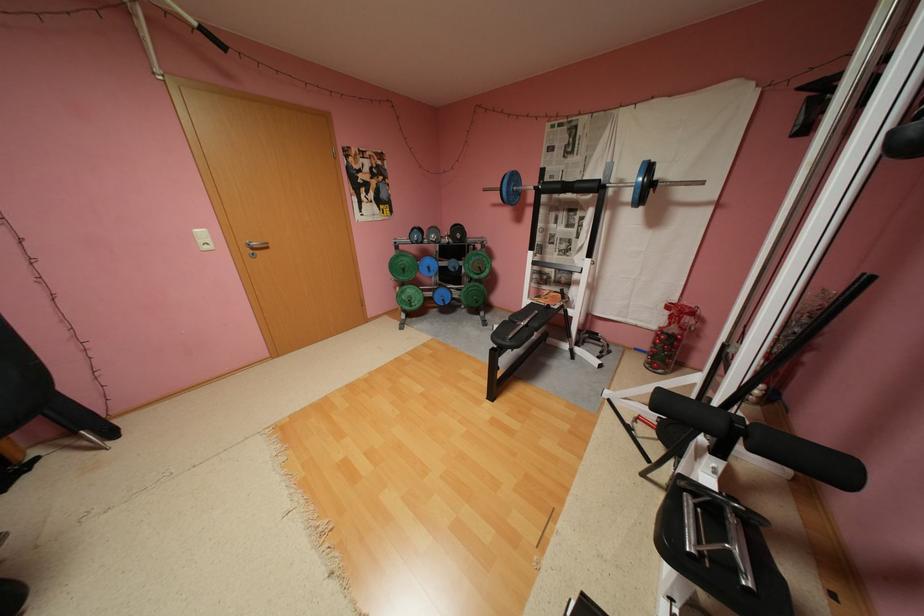
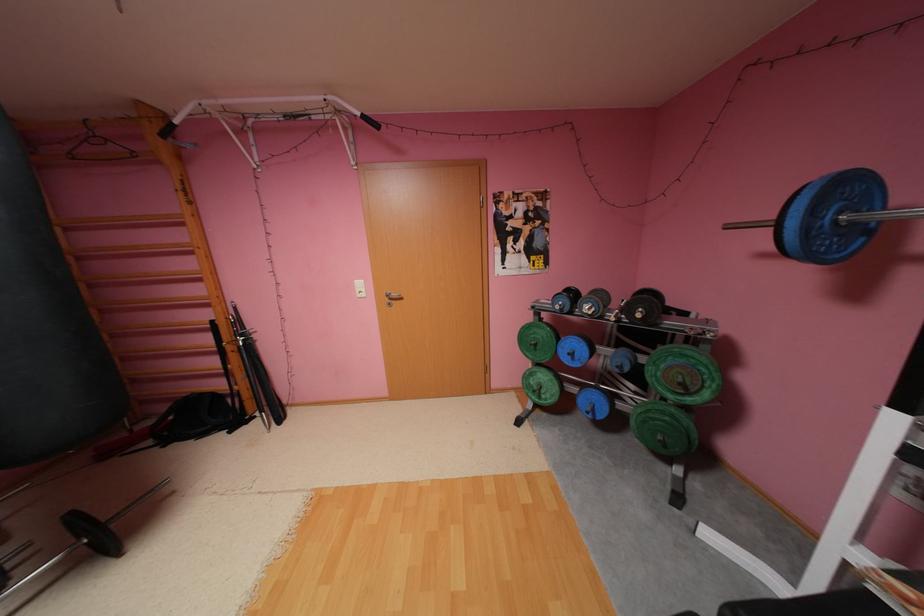
Find the pixel in the second image that matches pixel 523 177 in the first image.

(855, 188)